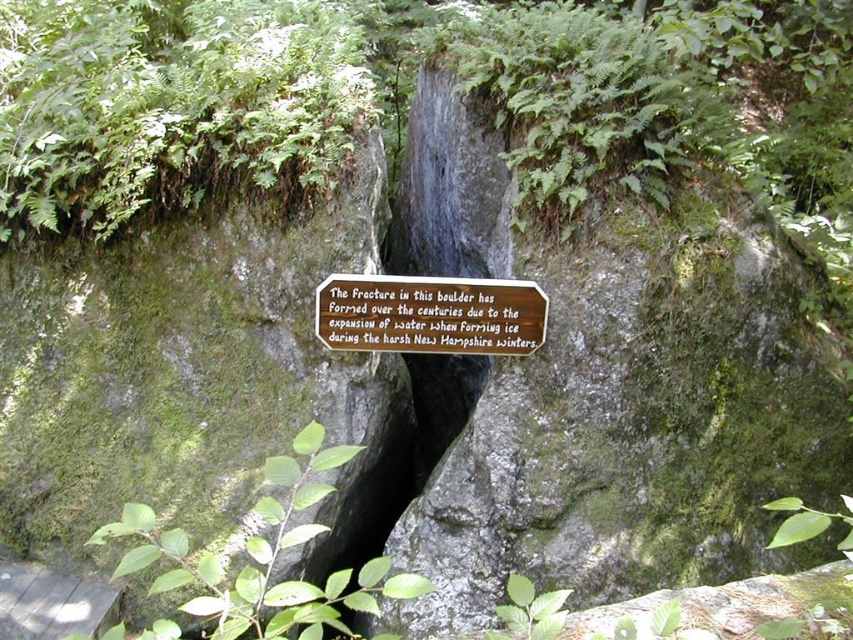
Question: Can you confirm if green mossy rock at center is positioned above bronze plaque at center?

Choices:
 (A) no
 (B) yes

Answer: (A)

Question: Does green mossy rock at center appear under bronze plaque at center?

Choices:
 (A) yes
 (B) no

Answer: (A)

Question: Among these points, which one is nearest to the camera?

Choices:
 (A) (535, 304)
 (B) (552, 272)

Answer: (A)

Question: Which of the following is the farthest from the observer?

Choices:
 (A) green mossy rock at center
 (B) bronze plaque at center

Answer: (B)

Question: Is green mossy rock at center positioned before bronze plaque at center?

Choices:
 (A) no
 (B) yes

Answer: (B)

Question: Which point is farther to the camera?

Choices:
 (A) pyautogui.click(x=674, y=280)
 (B) pyautogui.click(x=486, y=285)

Answer: (B)